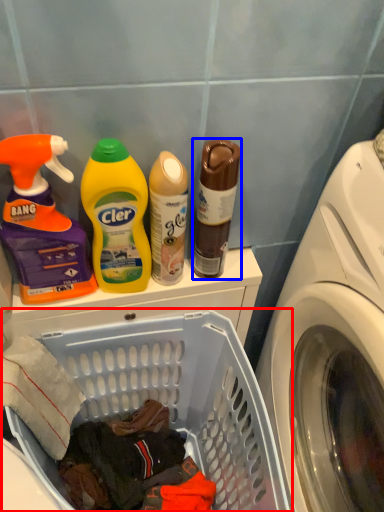
Question: Which object appears farthest to the camera in this image, laundry basket (highlighted by a red box) or bottle (highlighted by a blue box)?

Choices:
 (A) laundry basket
 (B) bottle

Answer: (B)